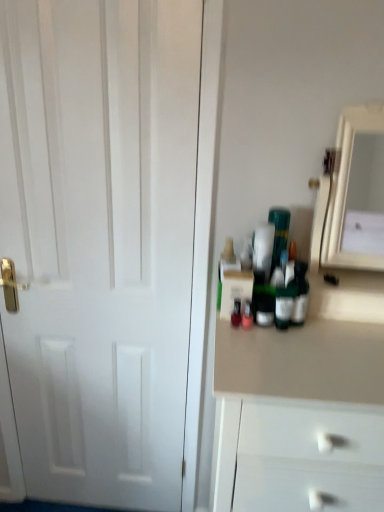
Question: Considering their positions, is white matte door at left located in front of or behind white glossy medicine cabinet at right?

Choices:
 (A) front
 (B) behind

Answer: (B)

Question: Considering the positions of white matte door at left and white glossy medicine cabinet at right in the image, is white matte door at left taller or shorter than white glossy medicine cabinet at right?

Choices:
 (A) short
 (B) tall

Answer: (B)

Question: Looking at their shapes, would you say white matte door at left is wider or thinner than white glossy medicine cabinet at right?

Choices:
 (A) wide
 (B) thin

Answer: (B)

Question: In the image, is white glossy medicine cabinet at right positioned in front of or behind white matte door at left?

Choices:
 (A) front
 (B) behind

Answer: (A)

Question: Considering the positions of white glossy medicine cabinet at right and white matte door at left in the image, is white glossy medicine cabinet at right wider or thinner than white matte door at left?

Choices:
 (A) wide
 (B) thin

Answer: (A)

Question: From the image's perspective, is white glossy medicine cabinet at right located above or below white matte door at left?

Choices:
 (A) below
 (B) above

Answer: (B)

Question: Based on their positions, is white glossy medicine cabinet at right located to the left or right of white matte door at left?

Choices:
 (A) right
 (B) left

Answer: (A)